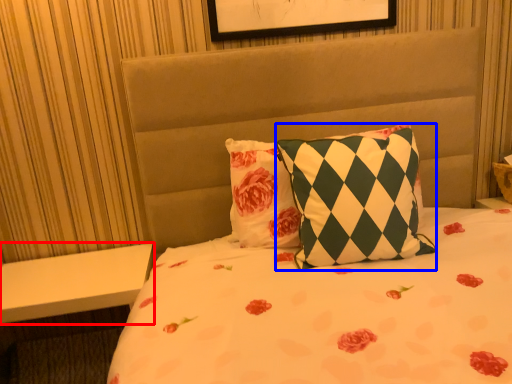
Question: Which object appears closest to the camera in this image, table (highlighted by a red box) or pillow (highlighted by a blue box)?

Choices:
 (A) table
 (B) pillow

Answer: (B)